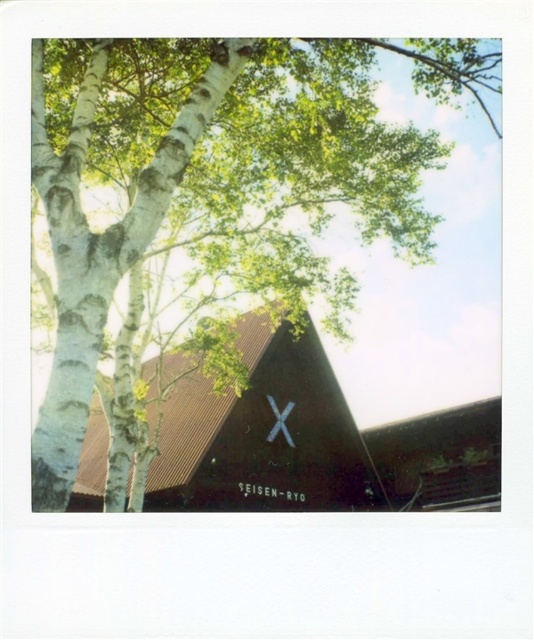
Can you confirm if brown corrugated metal chapel at center is positioned to the left of white matte cross at center?

Correct, you'll find brown corrugated metal chapel at center to the left of white matte cross at center.

Measure the distance between brown corrugated metal chapel at center and camera.

The distance of brown corrugated metal chapel at center from camera is 15.61 meters.

This screenshot has height=640, width=534. What are the coordinates of `brown corrugated metal chapel at center` in the screenshot? It's located at (263, 435).

Who is lower down, white bark tree at upper left or white matte cross at center?

white matte cross at center

Does point (244, 67) come behind point (289, 436)?

No, (244, 67) is in front of (289, 436).

This screenshot has height=640, width=534. Identify the location of white bark tree at upper left. (219, 179).

Does white bark tree at upper left appear under brown corrugated metal chapel at center?

Actually, white bark tree at upper left is above brown corrugated metal chapel at center.

Looking at this image, can you confirm if white bark tree at upper left is thinner than brown corrugated metal chapel at center?

No.

The image size is (534, 640). What do you see at coordinates (219, 179) in the screenshot?
I see `white bark tree at upper left` at bounding box center [219, 179].

The height and width of the screenshot is (640, 534). In order to click on white bark tree at upper left in this screenshot , I will do `click(219, 179)`.